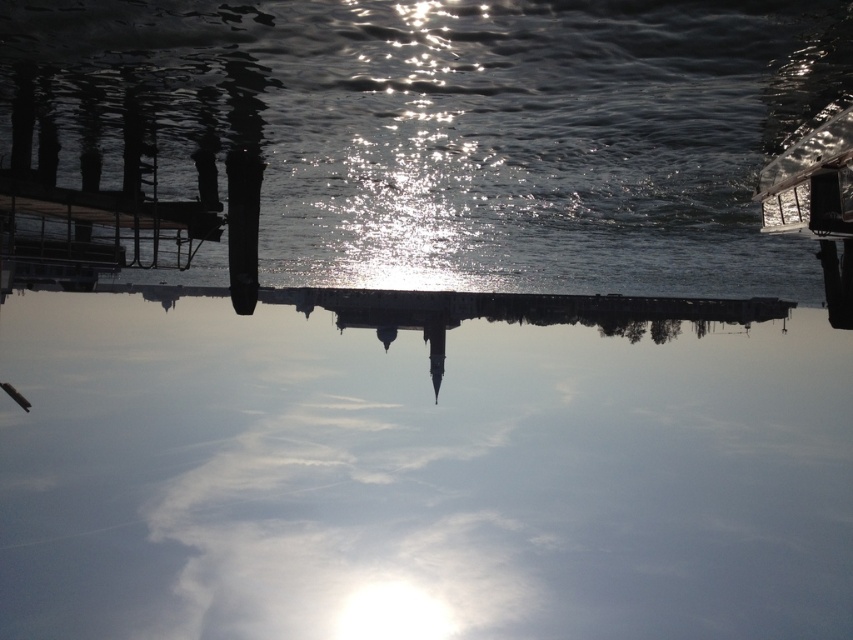
Question: Does transparent glass water at center have a smaller size compared to glistening water at center?

Choices:
 (A) no
 (B) yes

Answer: (A)

Question: Which object is the closest to the dark wood dock at left?

Choices:
 (A) glistening water at center
 (B) transparent glass water at center

Answer: (A)

Question: From the image, what is the correct spatial relationship of transparent glass water at center in relation to dark wood dock at left?

Choices:
 (A) left
 (B) right

Answer: (B)

Question: Does transparent glass water at center have a larger size compared to glistening water at center?

Choices:
 (A) no
 (B) yes

Answer: (B)

Question: Considering the real-world distances, which object is farthest from the dark wood dock at left?

Choices:
 (A) glistening water at center
 (B) transparent glass water at center

Answer: (B)

Question: Which point is farther from the camera taking this photo?

Choices:
 (A) (589, 10)
 (B) (107, 204)
 (C) (700, 449)

Answer: (C)